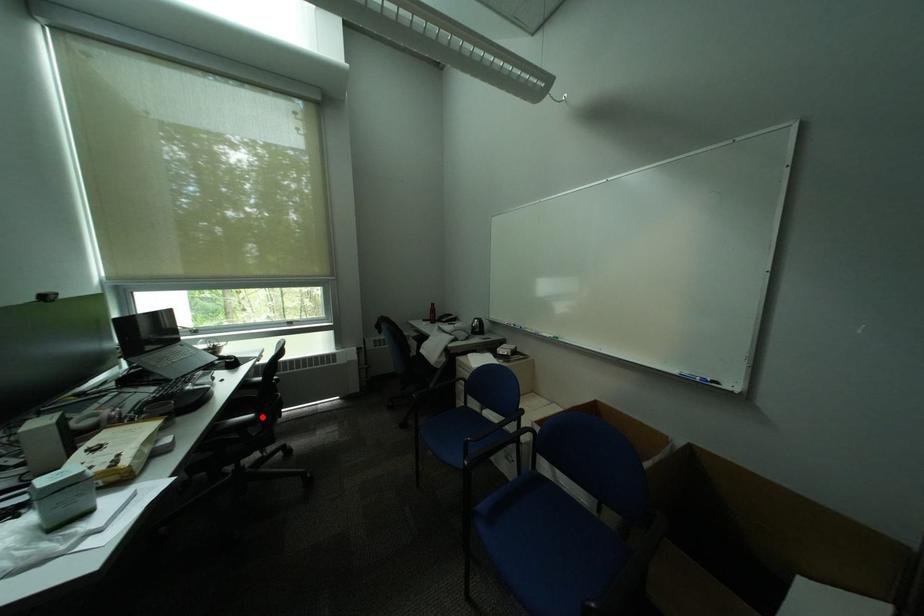
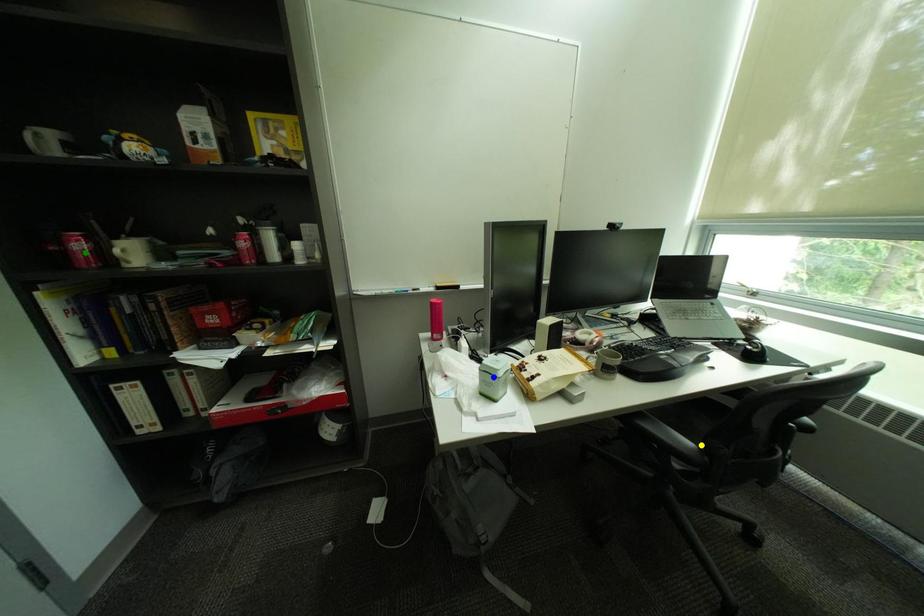
Question: I am providing you with two images of the same scene from different viewpoints. A red point is marked on the first image. You are given multiple points on the second image. Which mark in image 2 goes with the point in image 1?

Choices:
 (A) yellow point
 (B) green point
 (C) blue point

Answer: (A)